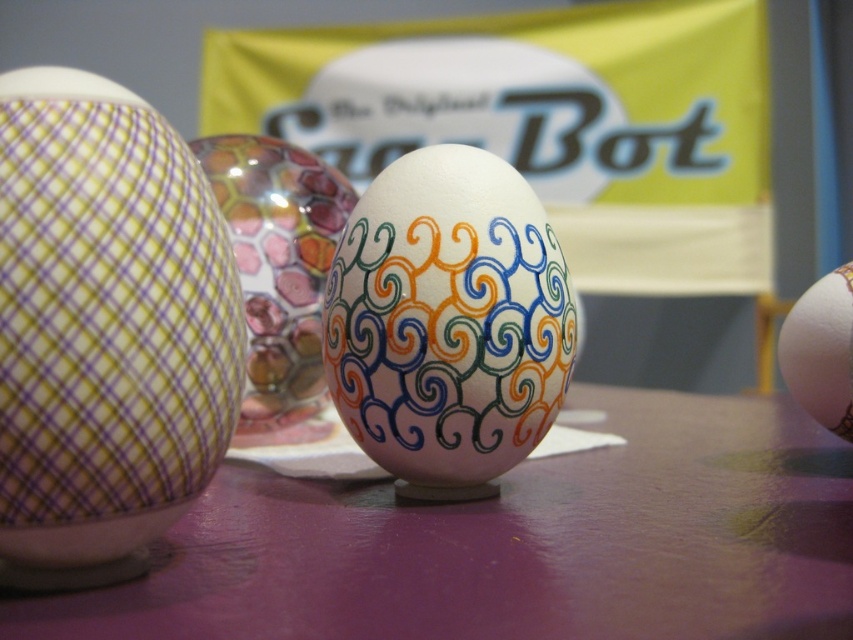
Question: Does purple matte table at center have a greater width compared to matte white egg at right?

Choices:
 (A) no
 (B) yes

Answer: (B)

Question: Estimate the real-world distances between objects in this image. Which object is farther from the matte white egg at right?

Choices:
 (A) colorful painted egg at center
 (B) matte purple checkered egg at left

Answer: (B)

Question: Among these objects, which one is farthest from the camera?

Choices:
 (A) colorful painted egg at center
 (B) purple matte table at center
 (C) matte purple checkered egg at left
 (D) matte white egg at right

Answer: (A)

Question: Can you confirm if purple matte table at center is positioned to the right of colorful painted egg at center?

Choices:
 (A) yes
 (B) no

Answer: (A)

Question: Can you confirm if purple matte table at center is bigger than matte purple checkered egg at left?

Choices:
 (A) yes
 (B) no

Answer: (A)

Question: Which object is the closest to the matte white egg at right?

Choices:
 (A) colorful painted egg at center
 (B) matte purple checkered egg at left
 (C) purple matte table at center

Answer: (C)